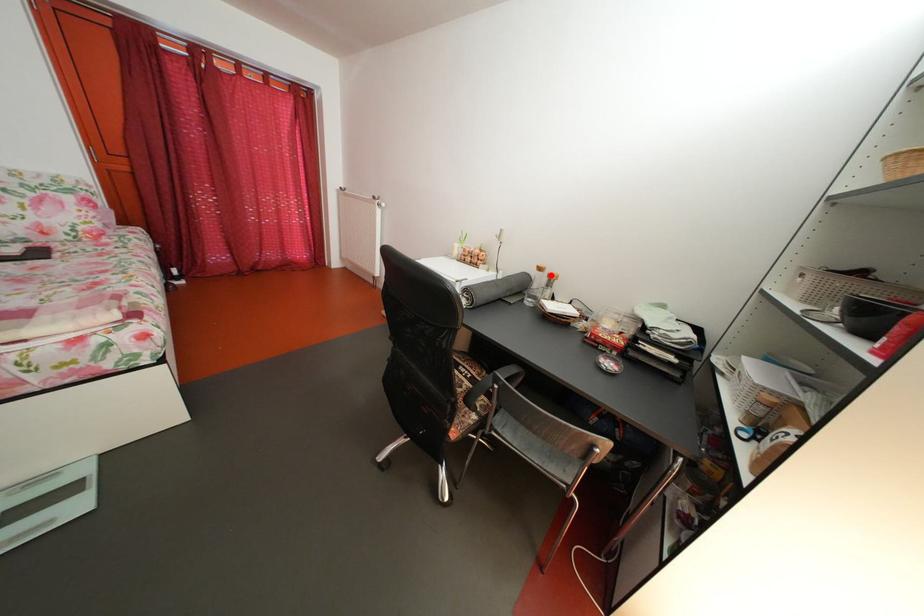
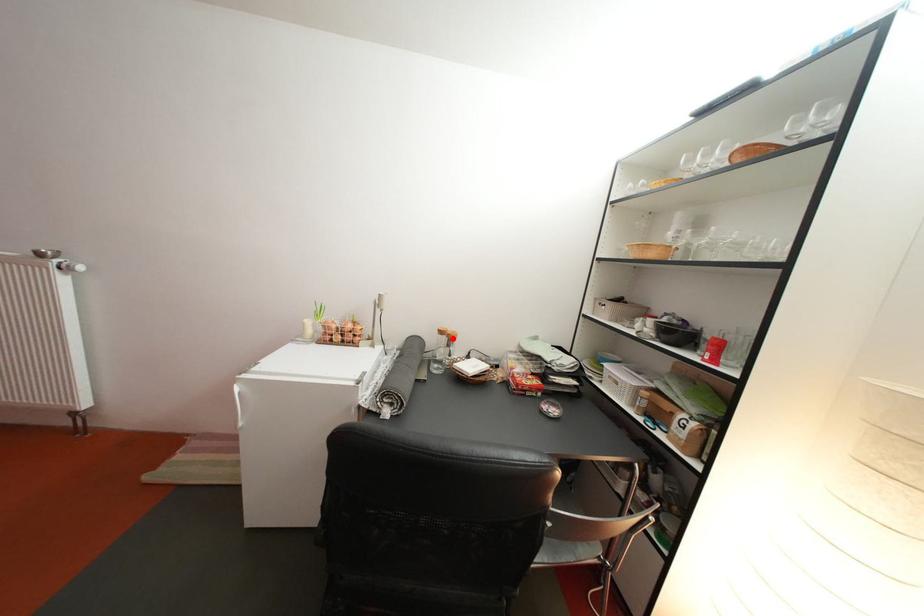
I am providing you with two images of the same scene from different viewpoints. A red point is marked on the first image and another point is marked on the second image. Is the marked point in image1 the same physical position as the marked point in image2?

Yes